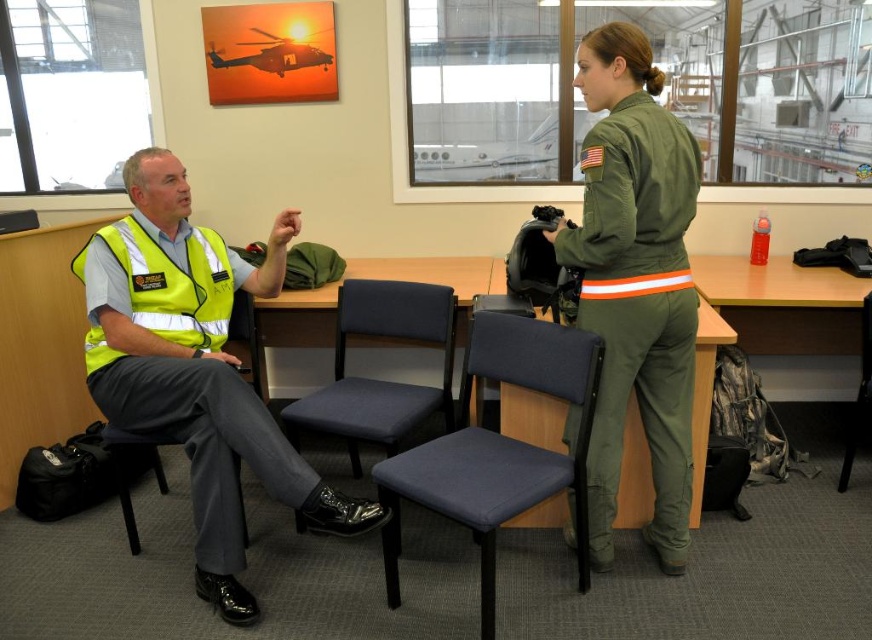
Consider the image. Between dark blue fabric chair at center and blue fabric chair at center, which one has less height?

blue fabric chair at center

Does dark blue fabric chair at center have a larger size compared to blue fabric chair at center?

Indeed, dark blue fabric chair at center has a larger size compared to blue fabric chair at center.

What do you see at coordinates (498, 449) in the screenshot? The image size is (872, 640). I see `dark blue fabric chair at center` at bounding box center [498, 449].

This screenshot has width=872, height=640. What are the coordinates of `dark blue fabric chair at center` in the screenshot? It's located at (498, 449).

Between wooden table at center and black fabric chair at center, which one has more height?

Standing taller between the two is black fabric chair at center.

Between point (631, 515) and point (869, 420), which one is positioned in front?

Point (631, 515)

Locate an element on the screen. The height and width of the screenshot is (640, 872). wooden table at center is located at coordinates (438, 276).

Is green fabric uniform at center smaller than blue fabric chair at center?

Incorrect, green fabric uniform at center is not smaller in size than blue fabric chair at center.

In the scene shown: Can you confirm if green fabric uniform at center is positioned to the left of blue fabric chair at center?

Incorrect, green fabric uniform at center is not on the left side of blue fabric chair at center.

Image resolution: width=872 pixels, height=640 pixels. I want to click on green fabric uniform at center, so click(638, 307).